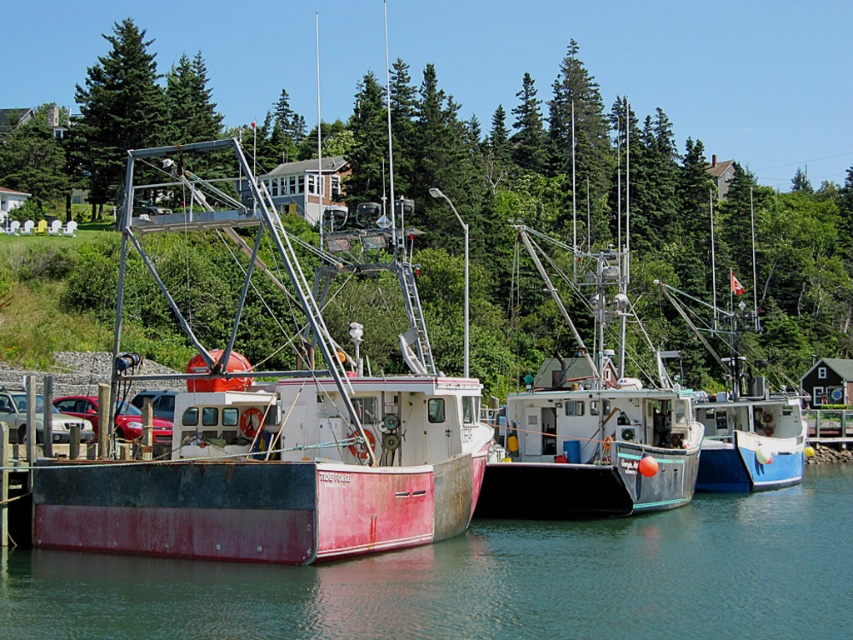
Between rusty metal boat at center and green leafy tree at upper left, which one has more height?

green leafy tree at upper left is taller.

In the scene shown: Does rusty metal boat at center appear under green leafy tree at upper left?

Yes.

Is point (231, 483) in front of point (30, 160)?

That is True.

This screenshot has height=640, width=853. What are the coordinates of `rusty metal boat at center` in the screenshot? It's located at (279, 452).

Is point (647, 536) in front of point (254, 468)?

No.

Describe the element at coordinates (486, 580) in the screenshot. I see `smooth water at center` at that location.

Locate an element on the screen. Image resolution: width=853 pixels, height=640 pixels. smooth water at center is located at coordinates (486, 580).

Which is behind, point (254, 433) or point (109, 38)?

Point (109, 38)

Identify the location of rusty metal boat at center. (279, 452).

The image size is (853, 640). Identify the location of rusty metal boat at center. (279, 452).